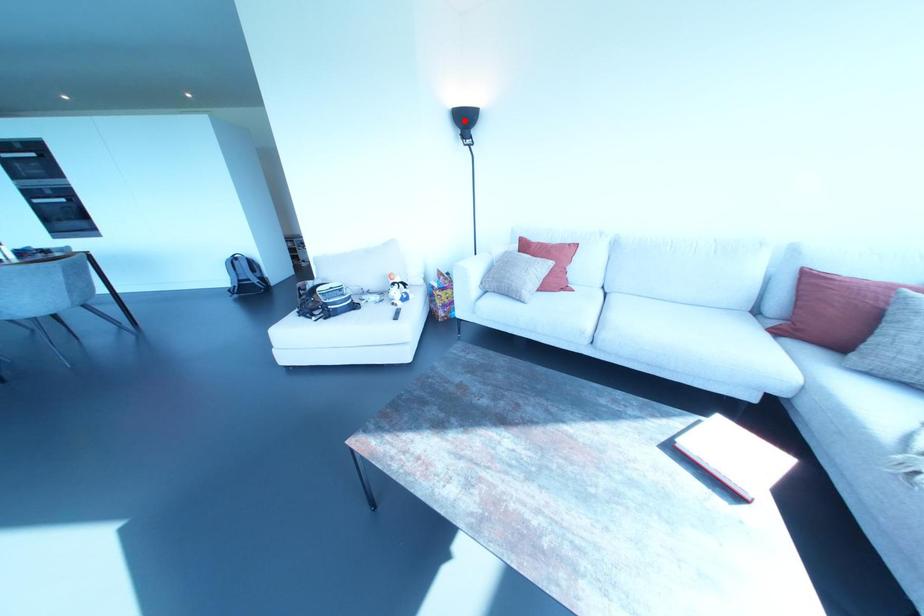
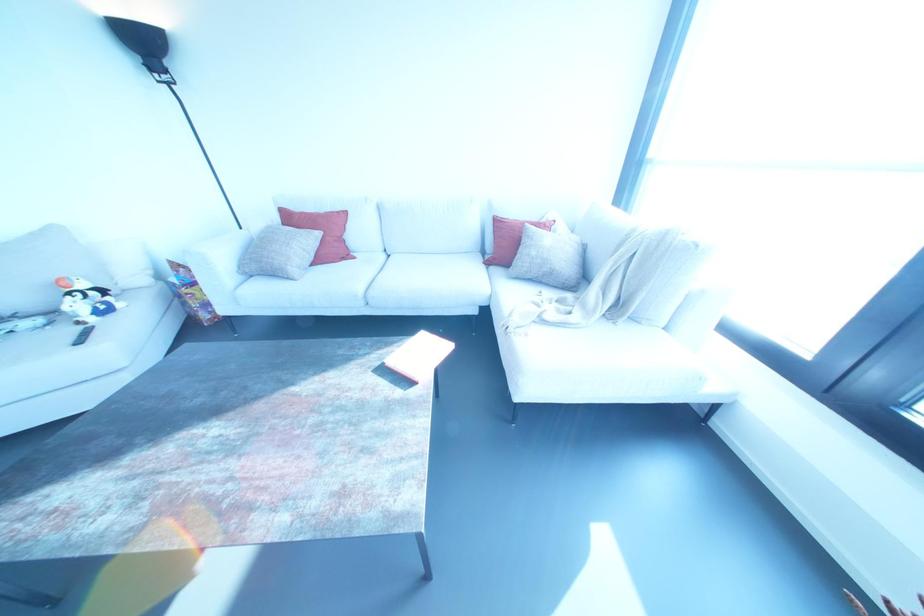
Question: I am providing you with two images of the same scene from different viewpoints. Image1 has a red point marked. In image2, the corresponding 3D location appears at what relative position? Reply with the corresponding letter.

Choices:
 (A) Closer
 (B) Farther

Answer: (B)